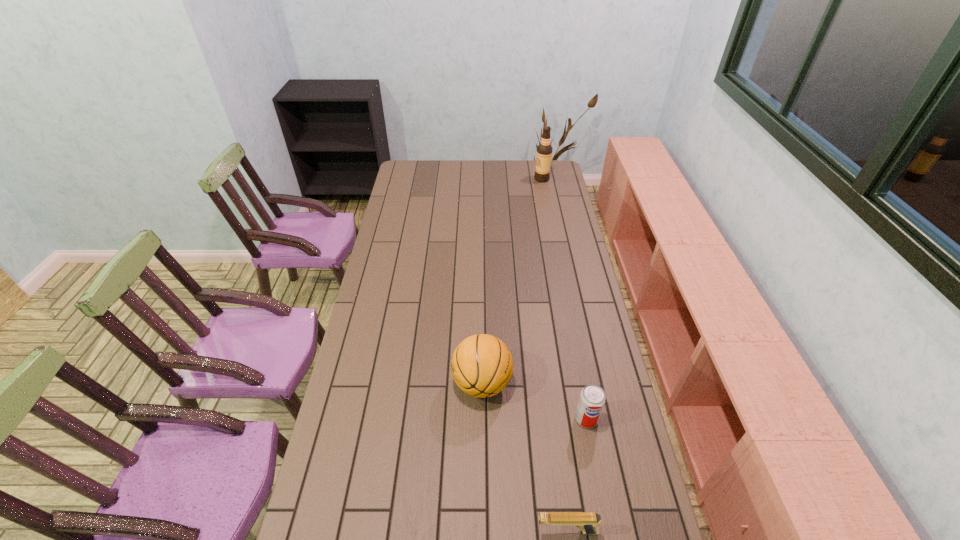
You are a GUI agent. You are given a task and a screenshot of the screen. Output one action in this format:
    pyautogui.click(x=<x>, y=<y>)
    Task: Click on the farthest object
    This screenshot has width=960, height=540.
    Given the screenshot: What is the action you would take?
    pyautogui.click(x=544, y=150)

Where is `the tallest object`? This screenshot has height=540, width=960. the tallest object is located at coordinates (544, 150).

Image resolution: width=960 pixels, height=540 pixels. What are the coordinates of `the leftmost object` in the screenshot? It's located at (482, 366).

You are a GUI agent. You are given a task and a screenshot of the screen. Output one action in this format:
    pyautogui.click(x=<x>, y=<y>)
    Task: Click on the basketball
    This screenshot has width=960, height=540.
    Given the screenshot: What is the action you would take?
    pyautogui.click(x=482, y=366)

Find the location of `soda`. soda is located at coordinates (592, 399).

Image resolution: width=960 pixels, height=540 pixels. What are the coordinates of `the shortest object` in the screenshot? It's located at (588, 522).

This screenshot has height=540, width=960. Find the location of `the nearest object`. the nearest object is located at coordinates (588, 522).

Where is `vacant space located 0.290m on the label of the tallest object`? Image resolution: width=960 pixels, height=540 pixels. vacant space located 0.290m on the label of the tallest object is located at coordinates 482,179.

Locate an element on the screen. The image size is (960, 540). vacant area located 0.370m on the label of the tallest object is located at coordinates (468, 179).

At what (x,y) coordinates should I click in order to perform the action: click on blank space located 0.220m on the label of the tallest object. Please return your answer as a coordinate pair (x, y). The width and height of the screenshot is (960, 540). Looking at the image, I should click on (494, 179).